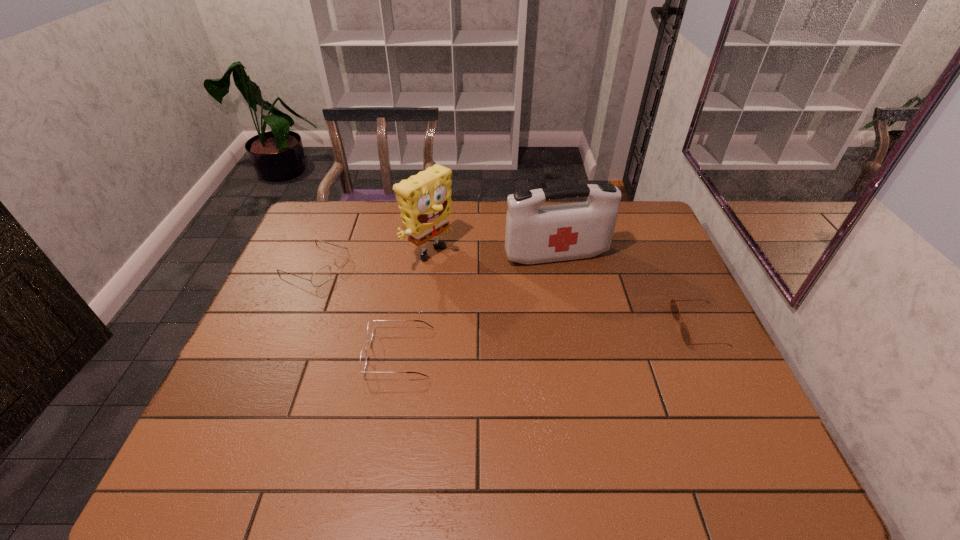
In order to click on vacant spot on the desktop that is between the nearer spectacles and the rightmost object and is positioned on the face of the sponge in this screenshot , I will do `click(558, 339)`.

Find the location of a particular element. free space on the desktop that is between the nearer spectacles and the shortest object and is positioned on the front side of the fourth object from left to right is located at coordinates (592, 336).

This screenshot has width=960, height=540. Find the location of `vacant space on the desktop that is between the right spectacles and the sunglasses and is positioned on the front-facing side of the left spectacles`. vacant space on the desktop that is between the right spectacles and the sunglasses and is positioned on the front-facing side of the left spectacles is located at coordinates (515, 343).